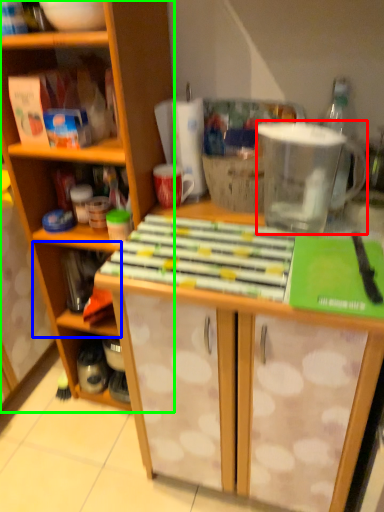
Question: Considering the real-world distances, which object is closest to appliance (highlighted by a red box)? shelf (highlighted by a blue box) or cabinetry (highlighted by a green box).

Choices:
 (A) shelf
 (B) cabinetry

Answer: (B)